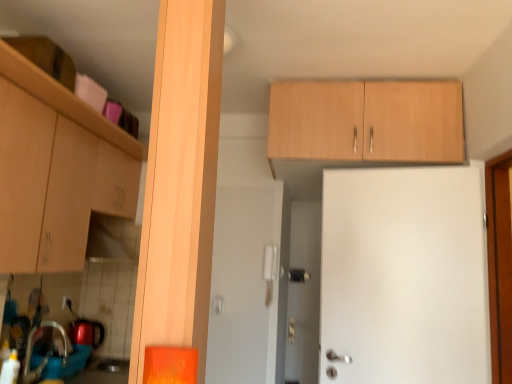
Question: Relative to brushed metal sink at lower left, is matte wood cabinet at left, acting as the first cabinetry starting from the left, in front or behind?

Choices:
 (A) front
 (B) behind

Answer: (A)

Question: From the image's perspective, is matte wood cabinet at left, acting as the first cabinetry starting from the left, positioned above or below brushed metal sink at lower left?

Choices:
 (A) above
 (B) below

Answer: (A)

Question: Which object is the closest to the white plastic electric outlet at lower left?

Choices:
 (A) matte wood cabinet at left, acting as the first cabinetry starting from the left
 (B) light wood cabinet at upper center, marked as the 2th cabinetry in a left-to-right arrangement
 (C) brushed metal sink at lower left

Answer: (C)

Question: Which is farther from the light wood cabinet at upper center, arranged as the 1th cabinetry when viewed from the right?

Choices:
 (A) white plastic electric outlet at lower left
 (B) matte wood cabinet at left, acting as the first cabinetry starting from the left
 (C) brushed metal sink at lower left

Answer: (A)